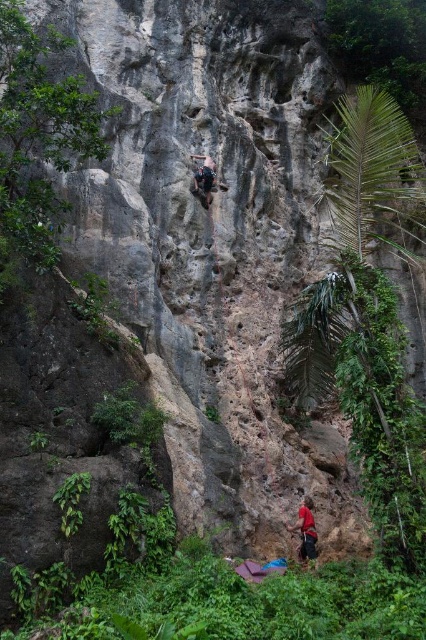
Question: Where is red fabric pants at lower center located in relation to matte black climbing harness at center in the image?

Choices:
 (A) below
 (B) above

Answer: (A)

Question: Is red fabric pants at lower center thinner than matte black climbing harness at center?

Choices:
 (A) no
 (B) yes

Answer: (A)

Question: Among these objects, which one is nearest to the camera?

Choices:
 (A) matte black climbing harness at center
 (B) red fabric pants at lower center

Answer: (B)

Question: Among these objects, which one is farthest from the camera?

Choices:
 (A) red fabric pants at lower center
 (B) matte black climbing harness at center

Answer: (B)

Question: Which point is closer to the camera?

Choices:
 (A) red fabric pants at lower center
 (B) matte black climbing harness at center

Answer: (A)

Question: Is red fabric pants at lower center thinner than matte black climbing harness at center?

Choices:
 (A) no
 (B) yes

Answer: (A)